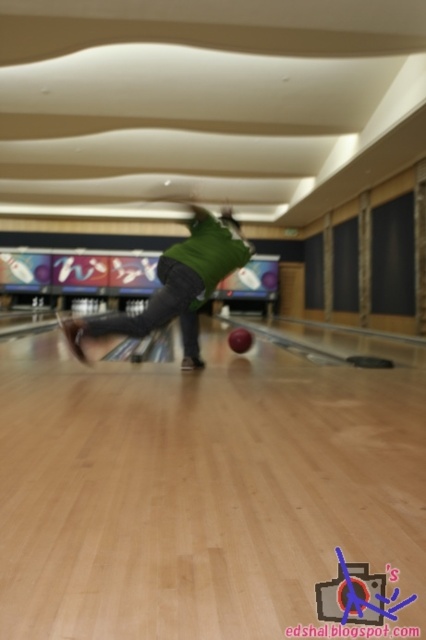
Question: From the image, what is the correct spatial relationship of green matte shirt at center in relation to shiny red bowling ball at center?

Choices:
 (A) right
 (B) left

Answer: (B)

Question: From the image, what is the correct spatial relationship of green matte shirt at center in relation to shiny red bowling ball at center?

Choices:
 (A) left
 (B) right

Answer: (A)

Question: Can you confirm if green matte shirt at center is positioned to the right of shiny red bowling ball at center?

Choices:
 (A) yes
 (B) no

Answer: (B)